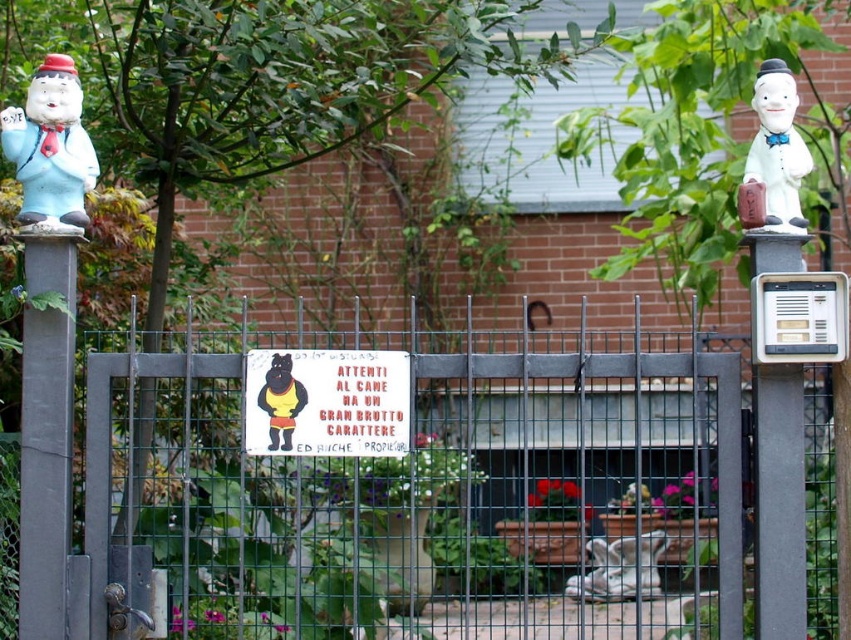
Does yellow paper sign at center have a lesser height compared to matte white statue at left?

Yes.

Between yellow paper sign at center and matte white statue at left, which one has more height?

With more height is matte white statue at left.

Describe the element at coordinates (326, 403) in the screenshot. I see `yellow paper sign at center` at that location.

Where is `yellow paper sign at center`? This screenshot has width=851, height=640. yellow paper sign at center is located at coordinates (326, 403).

Looking at this image, who is more forward, (33,456) or (837,284)?

Point (837,284)

Does metallic wire mesh gate at center have a lesser height compared to white plastic intercom at right?

Yes.

Find the location of a particular element. The height and width of the screenshot is (640, 851). metallic wire mesh gate at center is located at coordinates (421, 496).

Is yellow paper sign at center shorter than white porcelain figurine at upper right?

Indeed, yellow paper sign at center has a lesser height compared to white porcelain figurine at upper right.

Looking at this image, does yellow paper sign at center have a greater width compared to white porcelain figurine at upper right?

Correct, the width of yellow paper sign at center exceeds that of white porcelain figurine at upper right.

Is point (294, 403) closer to viewer compared to point (766, 92)?

No, it is not.

Locate an element on the screen. The width and height of the screenshot is (851, 640). yellow paper sign at center is located at coordinates (326, 403).